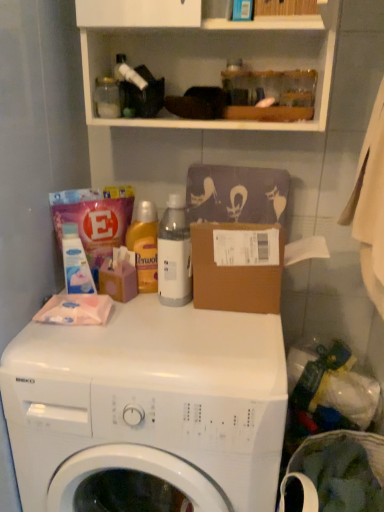
Question: From the image's perspective, is translucent plastic bottle at center positioned above or below white plastic bottle at center?

Choices:
 (A) above
 (B) below

Answer: (A)

Question: Is point (134, 226) positioned closer to the camera than point (178, 243)?

Choices:
 (A) closer
 (B) farther

Answer: (B)

Question: Considering the real-world distances, which object is closest to the white glossy washing machine at center?

Choices:
 (A) white plastic bottle at center
 (B) white matte detergent at left
 (C) translucent plastic bottle at center
 (D) white matte cabinet at upper center
 (E) wooden box at upper center

Answer: (A)

Question: Estimate the real-world distances between objects in this image. Which object is closer to the white matte detergent at left?

Choices:
 (A) white plastic bottle at center
 (B) white glossy washing machine at center
 (C) wooden box at upper center
 (D) translucent plastic bottle at center
 (E) clear plastic laundry basket at lower right

Answer: (D)